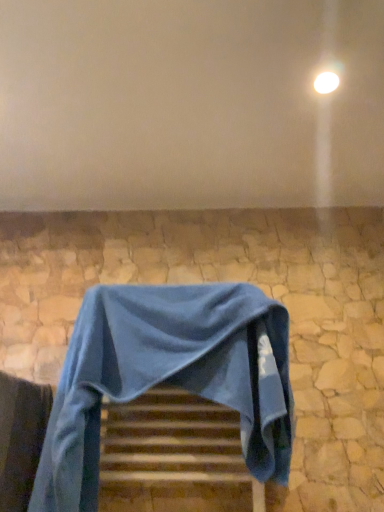
Question: Is matte white wall at upper center bigger or smaller than wooden stairs at center?

Choices:
 (A) big
 (B) small

Answer: (A)

Question: From the image's perspective, is matte white wall at upper center located above or below wooden stairs at center?

Choices:
 (A) below
 (B) above

Answer: (B)

Question: Estimate the real-world distances between objects in this image. Which object is closer to the wooden stairs at center?

Choices:
 (A) white glossy light at upper right
 (B) matte white wall at upper center
 (C) blue fabric chair at center

Answer: (C)

Question: Based on their relative distances, which object is nearer to the blue fabric chair at center?

Choices:
 (A) white glossy light at upper right
 (B) matte white wall at upper center
 (C) wooden stairs at center

Answer: (C)